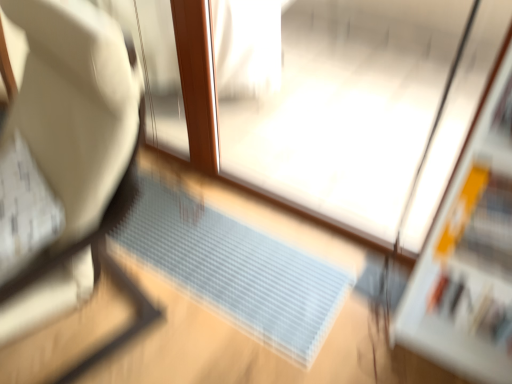
Question: Is transparent plastic screen door at center not close to translucent plastic doormat at center?

Choices:
 (A) yes
 (B) no

Answer: (B)

Question: Is transparent plastic screen door at center outside of translucent plastic doormat at center?

Choices:
 (A) yes
 (B) no

Answer: (A)

Question: Does transparent plastic screen door at center contain translucent plastic doormat at center?

Choices:
 (A) yes
 (B) no

Answer: (B)

Question: Is transparent plastic screen door at center at the left side of translucent plastic doormat at center?

Choices:
 (A) no
 (B) yes

Answer: (A)

Question: Is transparent plastic screen door at center positioned with its back to translucent plastic doormat at center?

Choices:
 (A) yes
 (B) no

Answer: (B)

Question: Considering the relative sizes of transparent plastic screen door at center and translucent plastic doormat at center in the image provided, is transparent plastic screen door at center wider than translucent plastic doormat at center?

Choices:
 (A) yes
 (B) no

Answer: (B)

Question: Would you say translucent plastic doormat at center is a long distance from transparent plastic screen door at center?

Choices:
 (A) no
 (B) yes

Answer: (A)

Question: From a real-world perspective, is translucent plastic doormat at center below transparent plastic screen door at center?

Choices:
 (A) yes
 (B) no

Answer: (A)

Question: Is the depth of translucent plastic doormat at center greater than that of transparent plastic screen door at center?

Choices:
 (A) no
 (B) yes

Answer: (B)

Question: Does translucent plastic doormat at center appear on the left side of transparent plastic screen door at center?

Choices:
 (A) no
 (B) yes

Answer: (B)

Question: From the image's perspective, is translucent plastic doormat at center below transparent plastic screen door at center?

Choices:
 (A) no
 (B) yes

Answer: (B)

Question: Does translucent plastic doormat at center have a larger size compared to transparent plastic screen door at center?

Choices:
 (A) no
 (B) yes

Answer: (A)

Question: Is white fabric chair at left positioned beyond the bounds of translucent plastic doormat at center?

Choices:
 (A) no
 (B) yes

Answer: (B)